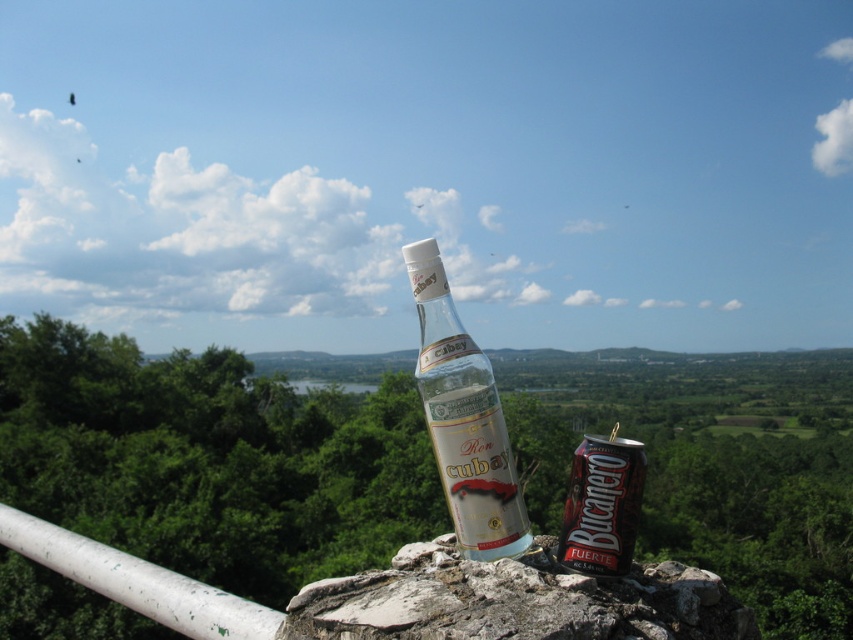
Can you confirm if clear glass bottle at center is thinner than metallic silver can at center?

No.

Who is more distant from viewer, (490, 444) or (585, 529)?

The point (490, 444) is behind.

I want to click on clear glass bottle at center, so click(x=463, y=419).